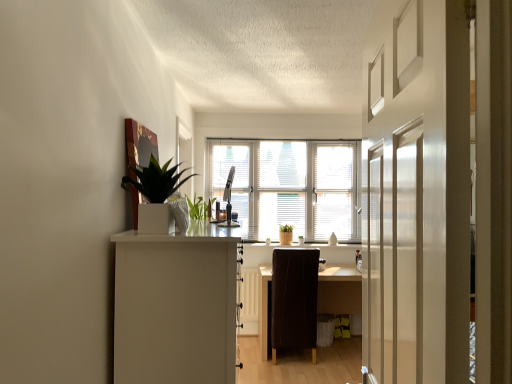
Question: Is the depth of white blinds at center less than that of dark brown wooden desk at center?

Choices:
 (A) no
 (B) yes

Answer: (A)

Question: Can you confirm if white blinds at center is wider than dark brown wooden desk at center?

Choices:
 (A) no
 (B) yes

Answer: (A)

Question: Is white blinds at center to the right of dark brown wooden desk at center from the viewer's perspective?

Choices:
 (A) no
 (B) yes

Answer: (A)

Question: Is white blinds at center facing towards dark brown wooden desk at center?

Choices:
 (A) yes
 (B) no

Answer: (B)

Question: Can dark brown wooden desk at center be found inside white blinds at center?

Choices:
 (A) no
 (B) yes

Answer: (A)

Question: From the image's perspective, does white blinds at center appear lower than dark brown wooden desk at center?

Choices:
 (A) no
 (B) yes

Answer: (A)

Question: From a real-world perspective, is brown leather chair at center located higher than dark brown wooden desk at center?

Choices:
 (A) no
 (B) yes

Answer: (B)

Question: Can you confirm if brown leather chair at center is shorter than dark brown wooden desk at center?

Choices:
 (A) yes
 (B) no

Answer: (B)

Question: Is brown leather chair at center beside dark brown wooden desk at center?

Choices:
 (A) yes
 (B) no

Answer: (B)

Question: Considering the relative sizes of brown leather chair at center and dark brown wooden desk at center in the image provided, is brown leather chair at center thinner than dark brown wooden desk at center?

Choices:
 (A) yes
 (B) no

Answer: (A)

Question: Does brown leather chair at center come behind dark brown wooden desk at center?

Choices:
 (A) yes
 (B) no

Answer: (B)

Question: Can you confirm if brown leather chair at center is smaller than dark brown wooden desk at center?

Choices:
 (A) yes
 (B) no

Answer: (A)

Question: Considering the relative sizes of white glossy window sill at center and white glossy planter at upper left in the image provided, is white glossy window sill at center bigger than white glossy planter at upper left?

Choices:
 (A) yes
 (B) no

Answer: (B)